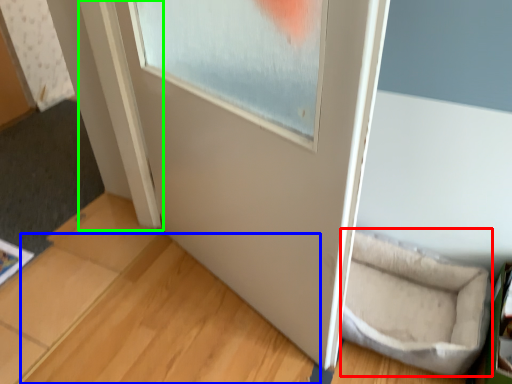
Question: Which object is the farthest from wide (highlighted by a red box)? Choose among these: wood (highlighted by a blue box) or window frame (highlighted by a green box).

Choices:
 (A) wood
 (B) window frame

Answer: (B)